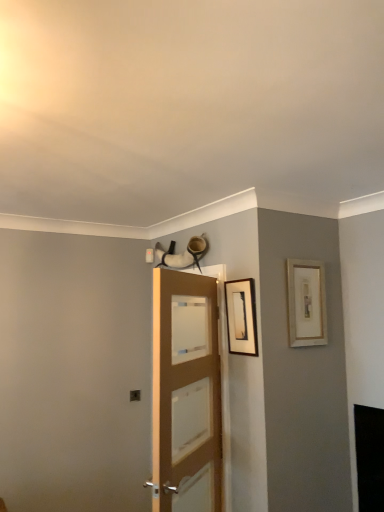
Question: From the image's perspective, is matte black picture frame at upper center, which is counted as the 2th picture frame, starting from the right, on top of gold-framed picture at upper right, the second picture frame when ordered from left to right?

Choices:
 (A) yes
 (B) no

Answer: (B)

Question: Is matte black picture frame at upper center, which is counted as the 2th picture frame, starting from the right, aimed at gold-framed picture at upper right, the second picture frame when ordered from left to right?

Choices:
 (A) no
 (B) yes

Answer: (A)

Question: Considering the relative sizes of matte black picture frame at upper center, which is counted as the 2th picture frame, starting from the right, and gold-framed picture at upper right, the second picture frame when ordered from left to right, in the image provided, is matte black picture frame at upper center, which is counted as the 2th picture frame, starting from the right, taller than gold-framed picture at upper right, the second picture frame when ordered from left to right,?

Choices:
 (A) yes
 (B) no

Answer: (B)

Question: Is matte black picture frame at upper center, which is counted as the 2th picture frame, starting from the right, thinner than gold-framed picture at upper right, the second picture frame when ordered from left to right?

Choices:
 (A) no
 (B) yes

Answer: (A)

Question: Does matte black picture frame at upper center, which is counted as the 2th picture frame, starting from the right, come behind gold-framed picture at upper right, the second picture frame when ordered from left to right?

Choices:
 (A) yes
 (B) no

Answer: (B)

Question: Is matte black picture frame at upper center, which is counted as the 2th picture frame, starting from the right, positioned with its back to gold-framed picture at upper right, which is counted as the 1th picture frame, starting from the right?

Choices:
 (A) yes
 (B) no

Answer: (A)

Question: Can you confirm if light brown wooden door at center is shorter than matte black picture frame at upper center, the 1th picture frame in the left-to-right sequence?

Choices:
 (A) no
 (B) yes

Answer: (A)

Question: Can you confirm if light brown wooden door at center is smaller than matte black picture frame at upper center, the 1th picture frame in the left-to-right sequence?

Choices:
 (A) yes
 (B) no

Answer: (B)

Question: Considering the relative sizes of light brown wooden door at center and matte black picture frame at upper center, the 1th picture frame in the left-to-right sequence, in the image provided, is light brown wooden door at center wider than matte black picture frame at upper center, the 1th picture frame in the left-to-right sequence,?

Choices:
 (A) yes
 (B) no

Answer: (A)

Question: Can you confirm if light brown wooden door at center is positioned to the right of matte black picture frame at upper center, the 1th picture frame in the left-to-right sequence?

Choices:
 (A) yes
 (B) no

Answer: (B)

Question: Can you confirm if light brown wooden door at center is positioned to the left of matte black picture frame at upper center, which is counted as the 2th picture frame, starting from the right?

Choices:
 (A) yes
 (B) no

Answer: (A)

Question: Is light brown wooden door at center taller than matte black picture frame at upper center, which is counted as the 2th picture frame, starting from the right?

Choices:
 (A) yes
 (B) no

Answer: (A)

Question: Is light brown wooden door at center positioned before gold-framed picture at upper right, which is counted as the 1th picture frame, starting from the right?

Choices:
 (A) yes
 (B) no

Answer: (A)